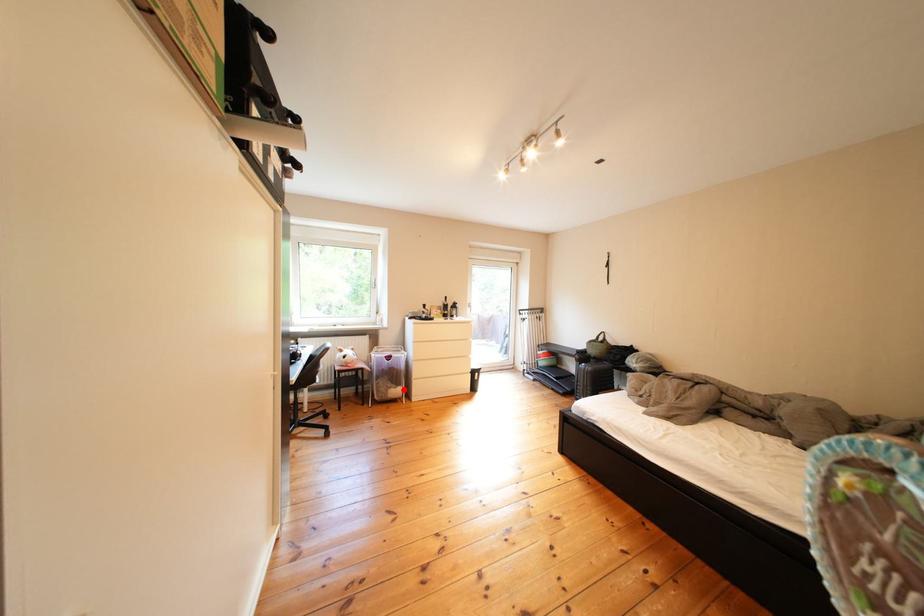
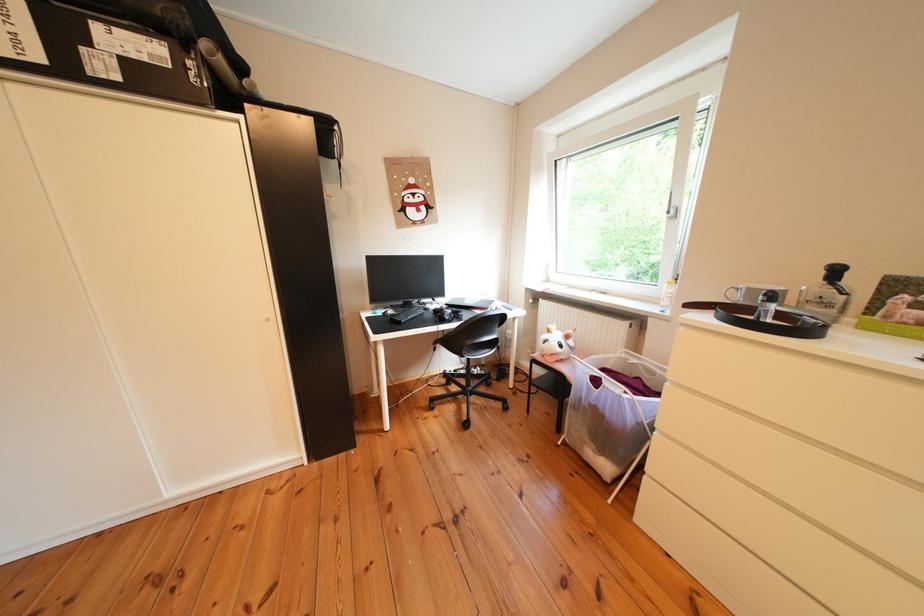
Question: I am providing you with two images of the same scene from different viewpoints. Given a red point in image1, look at the same physical point in image2. Is it:

Choices:
 (A) Closer to the viewpoint
 (B) Farther from the viewpoint

Answer: (A)